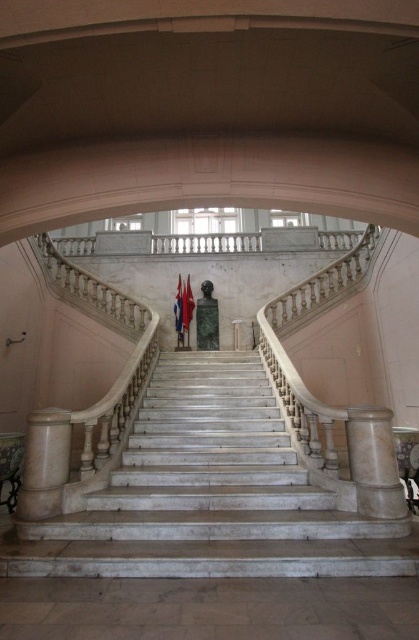
How much distance is there between white marble staircase at center and white marble pillar at lower left?

white marble staircase at center is 3.34 feet from white marble pillar at lower left.

Can you confirm if white marble staircase at center is bigger than white marble pillar at lower left?

Indeed, white marble staircase at center has a larger size compared to white marble pillar at lower left.

What do you see at coordinates (209, 493) in the screenshot?
I see `white marble staircase at center` at bounding box center [209, 493].

Locate an element on the screen. The width and height of the screenshot is (419, 640). white marble staircase at center is located at coordinates (209, 493).

Does white marble staircase at center lie in front of white marble pillar at lower right?

Yes.

Does point (172, 433) come farther from viewer compared to point (349, 465)?

That is True.

Where is `white marble staircase at center`? white marble staircase at center is located at coordinates (209, 493).

Does white marble pillar at lower right have a greater height compared to white marble pillar at lower left?

Yes.

Between point (385, 426) and point (33, 492), which one is positioned behind?

The point (385, 426) is behind.

Identify the location of white marble pillar at lower right. The width and height of the screenshot is (419, 640). (374, 461).